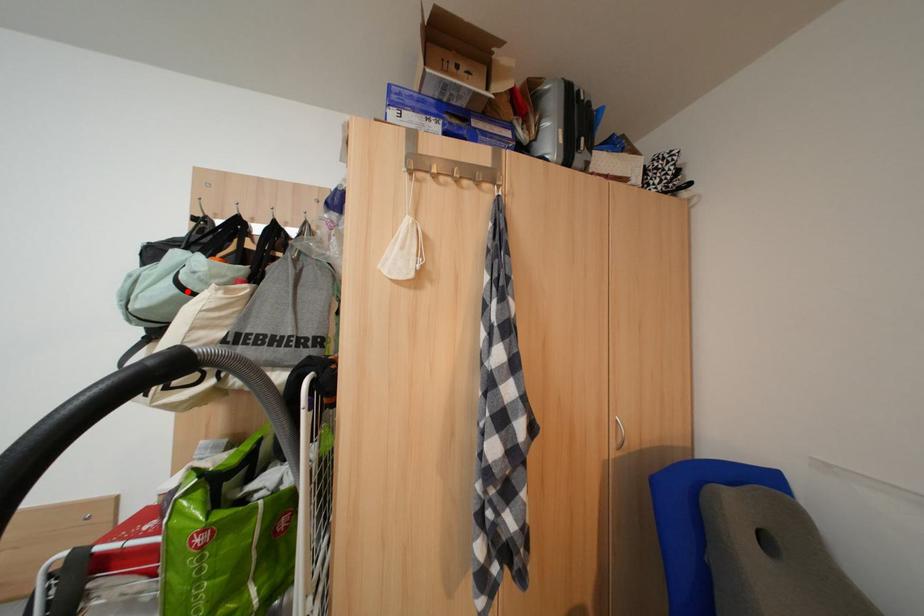
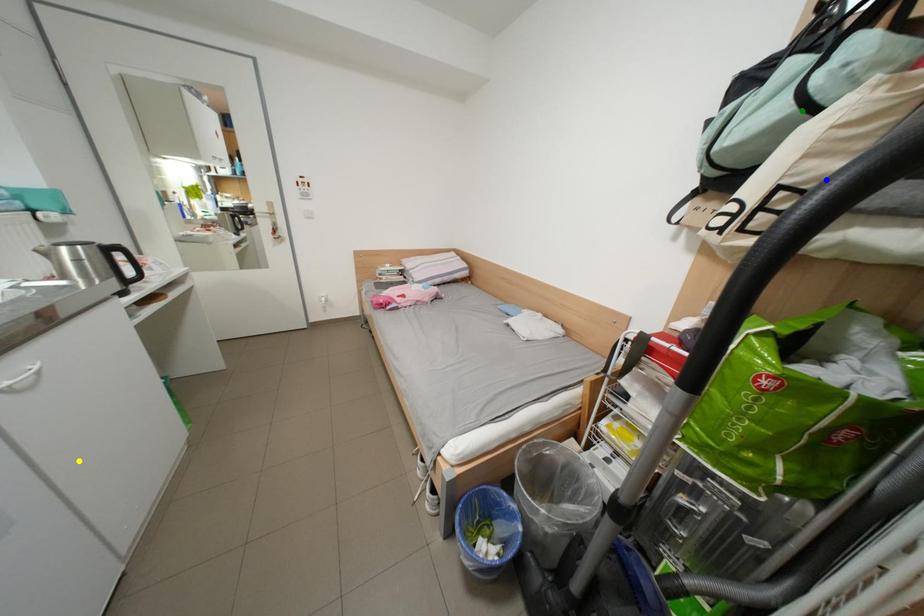
Question: I am providing you with two images of the same scene from different viewpoints. A red point is marked on the first image. You are given multiple points on the second image. Which point in image 2 represents the same 3d spot as the red point in image 1?

Choices:
 (A) yellow point
 (B) blue point
 (C) green point

Answer: (C)